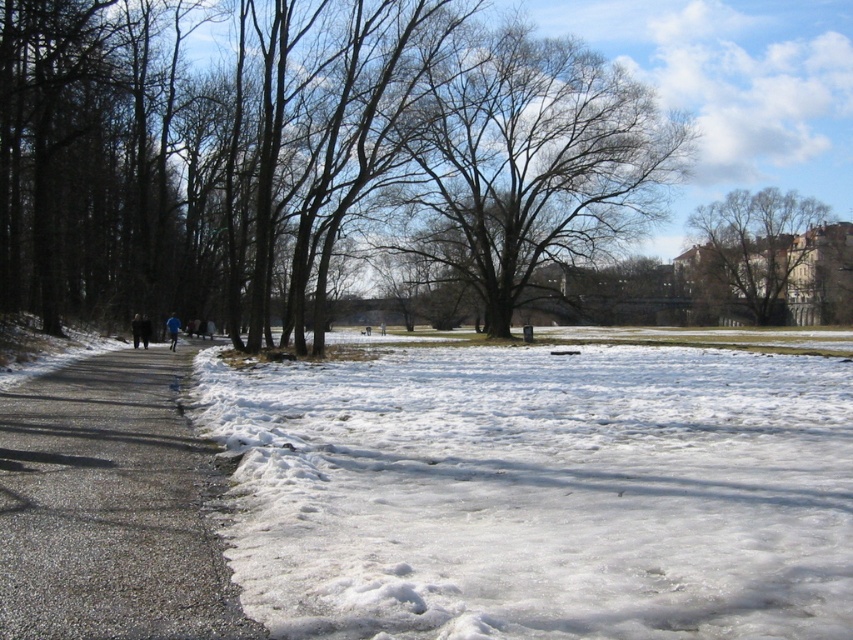
You are standing at the center of the paved path in the winter scene. You notice a green leafy tree at upper right. Based on its position, can you determine if it is closer to the left side of the image or the right side?

The green leafy tree at upper right is located at point (757, 241), which places it closer to the right side of the image compared to the left side.